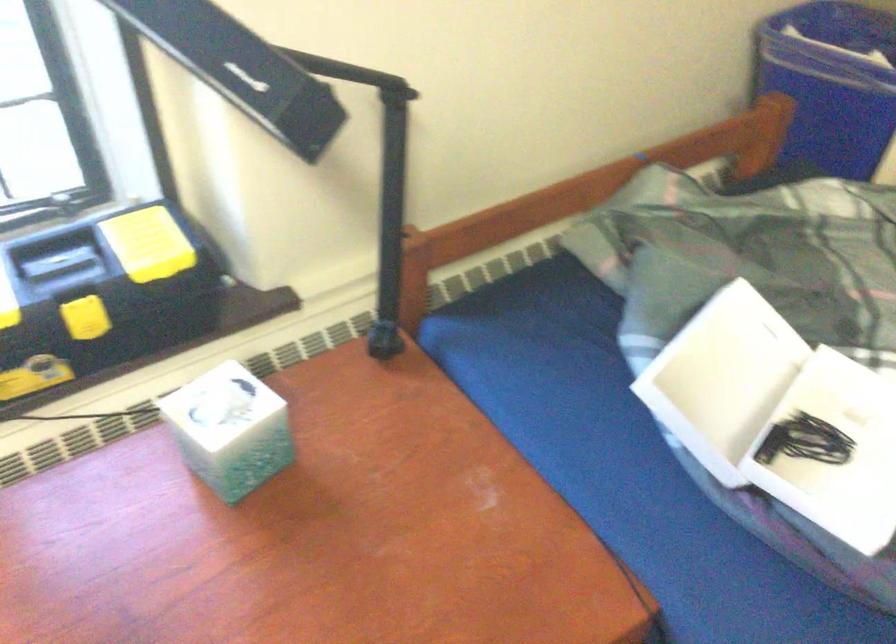
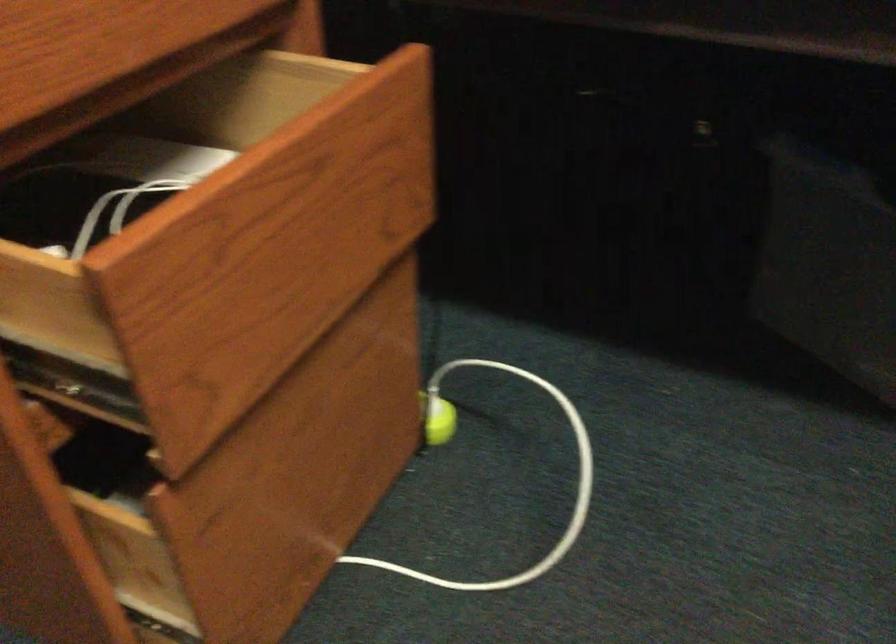
Question: The camera is either moving clockwise (left) or counter-clockwise (right) around the object. The first image is from the beginning of the video and the second image is from the end. Is the camera moving left or right when shooting the video?

Choices:
 (A) Left
 (B) Right

Answer: (A)